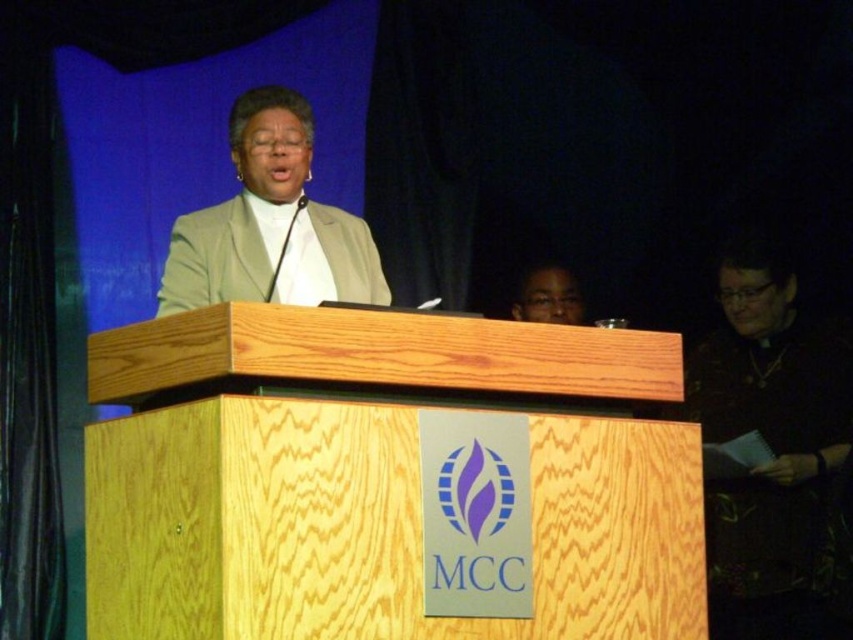
Question: Observing the image, what is the correct spatial positioning of black leather jacket at upper right in reference to beige fabric jacket at center?

Choices:
 (A) below
 (B) above

Answer: (A)

Question: Considering the real-world distances, which object is closest to the black leather jacket at upper right?

Choices:
 (A) matte black glasses at upper center
 (B) beige fabric jacket at center

Answer: (A)

Question: Does black leather jacket at upper right have a larger size compared to beige fabric jacket at center?

Choices:
 (A) yes
 (B) no

Answer: (A)

Question: Which point appears farthest from the camera in this image?

Choices:
 (A) (782, 332)
 (B) (213, 218)
 (C) (553, 307)

Answer: (C)

Question: Observing the image, what is the correct spatial positioning of black leather jacket at upper right in reference to matte black glasses at upper center?

Choices:
 (A) right
 (B) left

Answer: (A)

Question: Which object is positioned closest to the beige fabric jacket at center?

Choices:
 (A) black leather jacket at upper right
 (B) matte black glasses at upper center

Answer: (B)